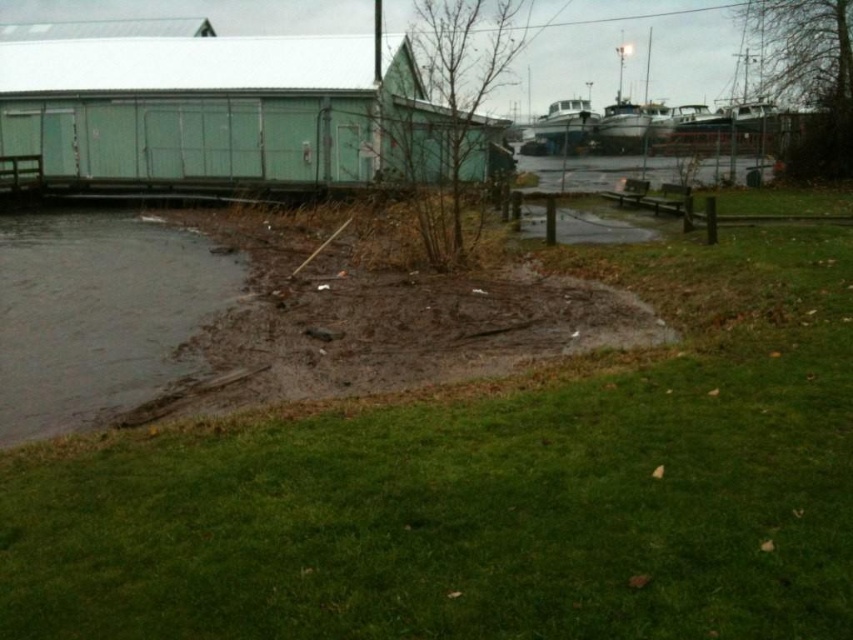
Question: Does muddy wet ground at lower center appear under white glossy boat at upper center?

Choices:
 (A) yes
 (B) no

Answer: (A)

Question: Can you confirm if green matte shed at upper left is bigger than white glossy boat at upper center?

Choices:
 (A) no
 (B) yes

Answer: (B)

Question: Can you confirm if muddy wet ground at lower center is positioned above clear water at center?

Choices:
 (A) yes
 (B) no

Answer: (B)

Question: Which of the following is the farthest from the observer?

Choices:
 (A) green matte shed at upper left
 (B) white glossy boat at upper center

Answer: (B)

Question: Which object is closer to the camera taking this photo?

Choices:
 (A) white glossy boat at upper center
 (B) green grass at lower left
 (C) green matte shed at upper left

Answer: (B)

Question: Which of the following is the farthest from the observer?

Choices:
 (A) white glossy boat at upper center
 (B) green matte shed at upper left

Answer: (A)